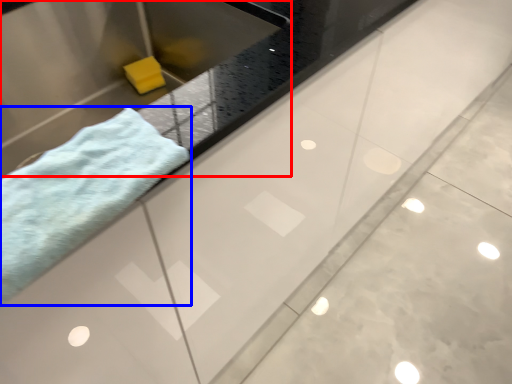
Question: Which object appears closest to the camera in this image, sink (highlighted by a red box) or towel (highlighted by a blue box)?

Choices:
 (A) sink
 (B) towel

Answer: (B)